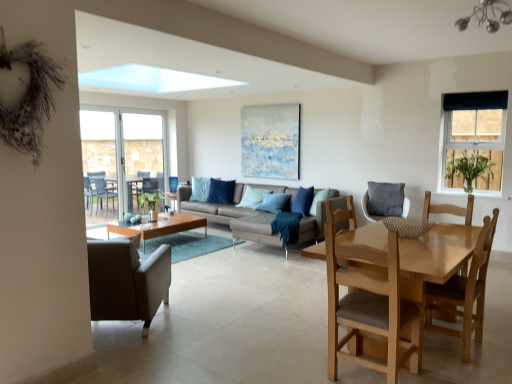
Question: Is light blue fabric pillow at center, arranged as the second pillow when viewed from the front, far away from dark blue fabric curtain at upper right, which appears as the first window when viewed from the right?

Choices:
 (A) no
 (B) yes

Answer: (B)

Question: Is light blue fabric pillow at center, arranged as the second pillow when viewed from the front, at the left side of dark blue fabric curtain at upper right, marked as the first window in a front-to-back arrangement?

Choices:
 (A) no
 (B) yes

Answer: (B)

Question: From the image's perspective, does light blue fabric pillow at center, the 2th pillow in the back-to-front sequence, appear higher than dark blue fabric curtain at upper right, the 2th window from the back?

Choices:
 (A) no
 (B) yes

Answer: (A)

Question: Is the position of light blue fabric pillow at center, the 2th pillow in the back-to-front sequence, more distant than that of dark blue fabric curtain at upper right, marked as the first window in a front-to-back arrangement?

Choices:
 (A) no
 (B) yes

Answer: (B)

Question: Does light blue fabric pillow at center, the 2th pillow in the back-to-front sequence, appear on the right side of dark blue fabric curtain at upper right, the 2th window viewed from the left?

Choices:
 (A) no
 (B) yes

Answer: (A)

Question: Considering the positions of dark blue fabric curtain at upper right, the 2th window from the back, and chrome metallic chandelier at upper right in the image, is dark blue fabric curtain at upper right, the 2th window from the back, wider or thinner than chrome metallic chandelier at upper right?

Choices:
 (A) wide
 (B) thin

Answer: (B)

Question: Considering their positions, is dark blue fabric curtain at upper right, which appears as the first window when viewed from the right, located in front of or behind chrome metallic chandelier at upper right?

Choices:
 (A) behind
 (B) front

Answer: (A)

Question: Visually, is dark blue fabric curtain at upper right, which appears as the first window when viewed from the right, positioned to the left or to the right of chrome metallic chandelier at upper right?

Choices:
 (A) right
 (B) left

Answer: (A)

Question: Considering the positions of dark blue fabric curtain at upper right, marked as the first window in a front-to-back arrangement, and chrome metallic chandelier at upper right in the image, is dark blue fabric curtain at upper right, marked as the first window in a front-to-back arrangement, taller or shorter than chrome metallic chandelier at upper right?

Choices:
 (A) short
 (B) tall

Answer: (B)

Question: Based on their positions, is blue plastic chairs at left, which is the 1th screen door from left to right, located to the left or right of dark blue fabric curtain at upper right, the 2th window viewed from the left?

Choices:
 (A) left
 (B) right

Answer: (A)

Question: From their relative heights in the image, would you say blue plastic chairs at left, which is the 1th screen door from left to right, is taller or shorter than dark blue fabric curtain at upper right, which appears as the first window when viewed from the right?

Choices:
 (A) short
 (B) tall

Answer: (B)

Question: Does point (84, 170) appear closer or farther from the camera than point (453, 102)?

Choices:
 (A) closer
 (B) farther

Answer: (B)

Question: In the image, is blue plastic chairs at left, which appears as the second screen door when viewed from the right, positioned in front of or behind dark blue fabric curtain at upper right, the 2th window from the back?

Choices:
 (A) front
 (B) behind

Answer: (B)

Question: Considering the positions of dark blue fabric at upper right and gray fabric cushion at center, the first chair viewed from the back, in the image, is dark blue fabric at upper right bigger or smaller than gray fabric cushion at center, the first chair viewed from the back,?

Choices:
 (A) big
 (B) small

Answer: (B)

Question: Is dark blue fabric at upper right in front of or behind gray fabric cushion at center, arranged as the 4th chair when viewed from the left, in the image?

Choices:
 (A) front
 (B) behind

Answer: (A)